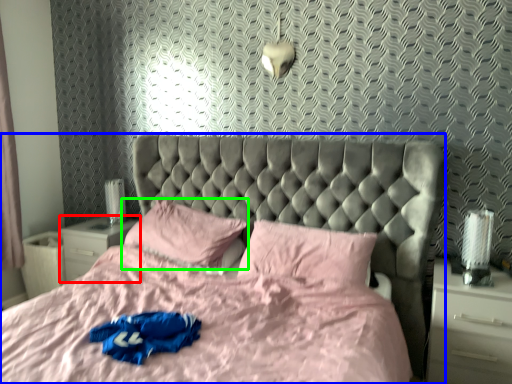
Question: Based on their relative distances, which object is farther from nightstand (highlighted by a red box)? Choose from bed (highlighted by a blue box) and pillow (highlighted by a green box).

Choices:
 (A) bed
 (B) pillow

Answer: (A)